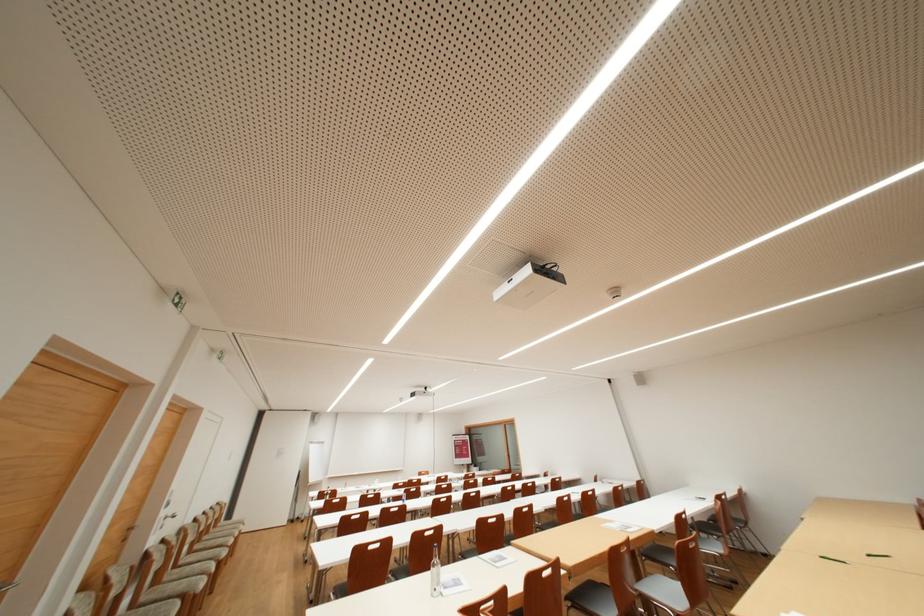
Find where to lift the white paper sheet. Please return your answer as a coordinate pair (x, y).

(438, 589)